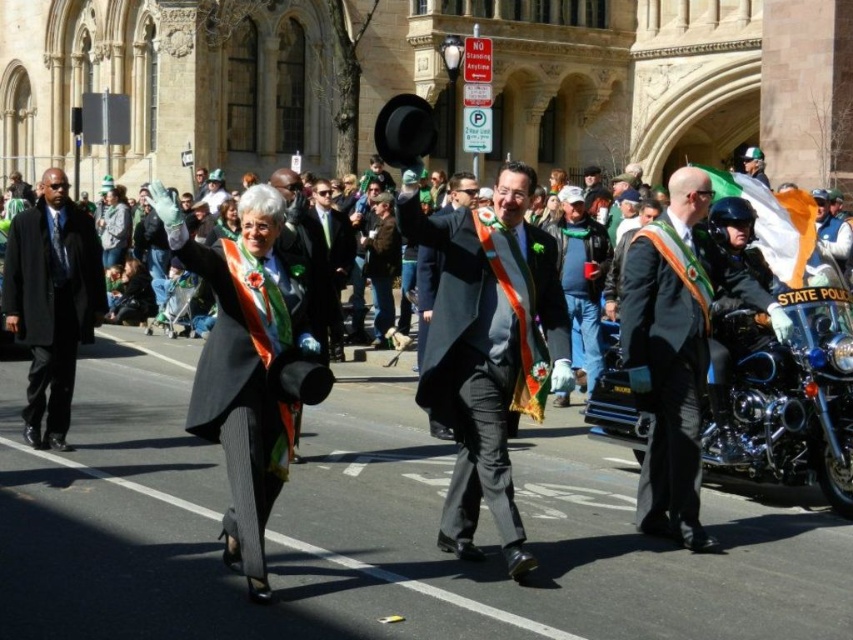
You are a photographer standing at the center of the street. You want to take a photo of the gray wool business suit at right. Which direction should you move to get the best shot?

The gray wool business suit at right is located at point 0.584 on the x axis and 0.782 on the y axis. To get the best shot, move towards the right side of the street since the gray wool business suit at right is positioned towards the right in the image.

You are a photographer standing at point (381, 557). You want to take a photo of the two people in the parade. How far apart are they from each other?

The two people are 27.72 meters apart.

You are a photographer standing at the back of the crowd, wanting to capture both the matte black hat at center and the shiny black coat at center in a single photo. The camera you have can focus on objects within a 15 feet range. Can both objects be in focus at the same time?

The matte black hat at center and shiny black black coat at center are 20.46 feet apart from each other. Since the camera can only focus on objects within a 15 feet range, both objects cannot be in focus simultaneously because the distance between them exceeds the camera focus range.